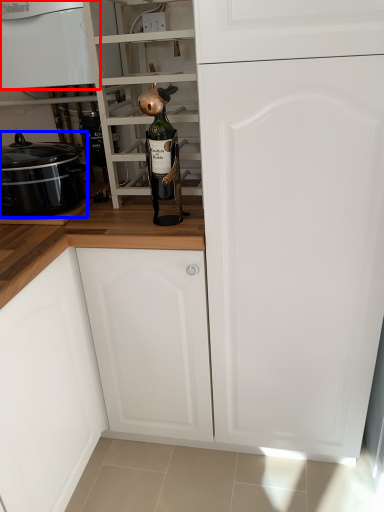
Question: Among these objects, which one is nearest to the camera, home appliance (highlighted by a red box) or kitchen appliance (highlighted by a blue box)?

Choices:
 (A) home appliance
 (B) kitchen appliance

Answer: (A)